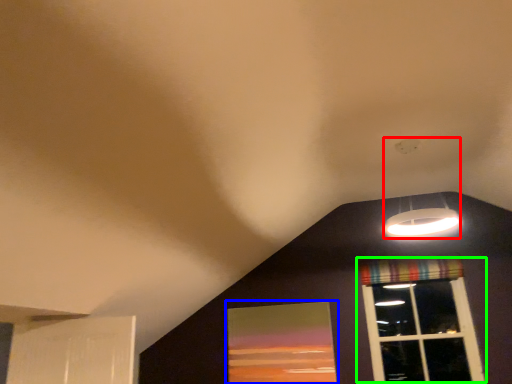
Question: Estimate the real-world distances between objects in this image. Which object is closer to lamp (highlighted by a red box), window screen (highlighted by a blue box) or window (highlighted by a green box)?

Choices:
 (A) window screen
 (B) window

Answer: (B)